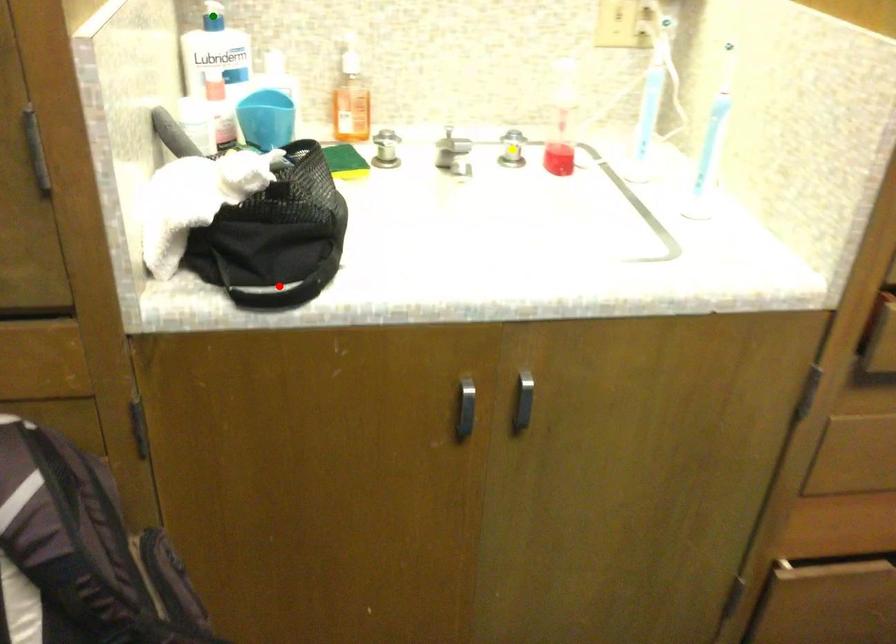
Order these from farthest to nearest:
- green point
- yellow point
- red point

yellow point, green point, red point